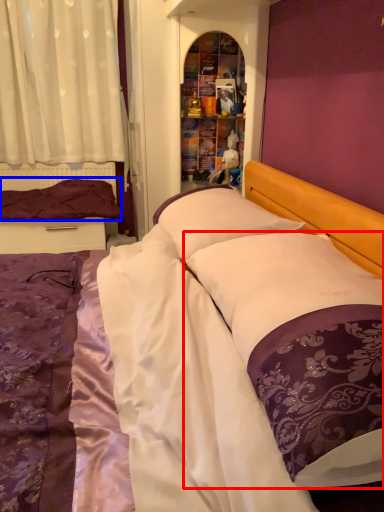
Question: Which point is further to the camera, pillow (highlighted by a red box) or pillow (highlighted by a blue box)?

Choices:
 (A) pillow
 (B) pillow

Answer: (B)